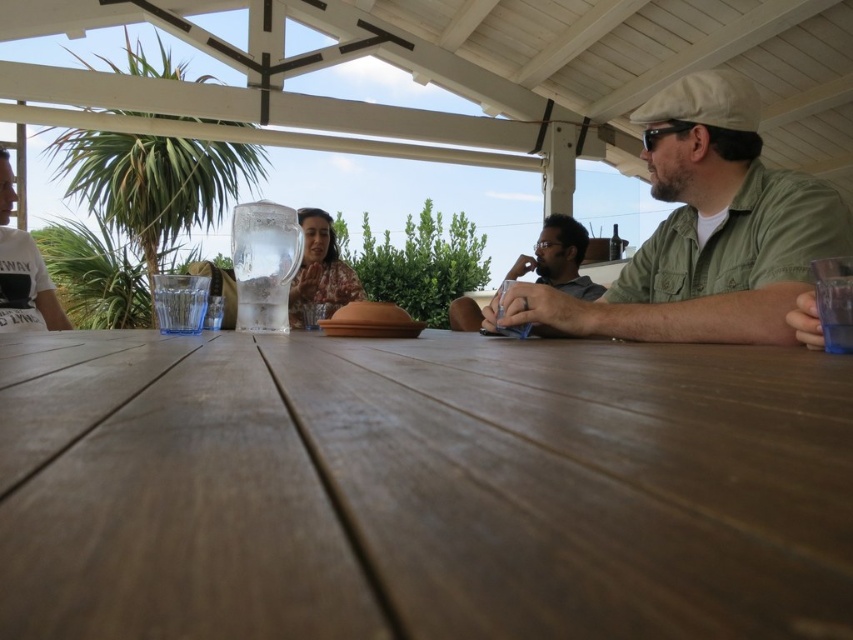
Question: Does khaki cotton cap at upper right appear on the right side of matte brown shirt at center?

Choices:
 (A) yes
 (B) no

Answer: (B)

Question: Which object is positioned farthest from the printed fabric shirt at center?

Choices:
 (A) matte brown shirt at center
 (B) brown wooden table at center
 (C) translucent glass pitcher at center

Answer: (B)

Question: Can you confirm if khaki cotton cap at upper right is thinner than matte brown shirt at center?

Choices:
 (A) no
 (B) yes

Answer: (A)

Question: Which object appears farthest from the camera in this image?

Choices:
 (A) matte brown shirt at center
 (B) printed fabric shirt at center
 (C) translucent glass pitcher at center

Answer: (A)

Question: Which point is farther from the camera taking this photo?

Choices:
 (A) (270, 310)
 (B) (730, 240)
 (C) (561, 234)
 (D) (730, 396)

Answer: (C)

Question: Is khaki cotton cap at upper right to the right of matte brown shirt at center from the viewer's perspective?

Choices:
 (A) yes
 (B) no

Answer: (B)